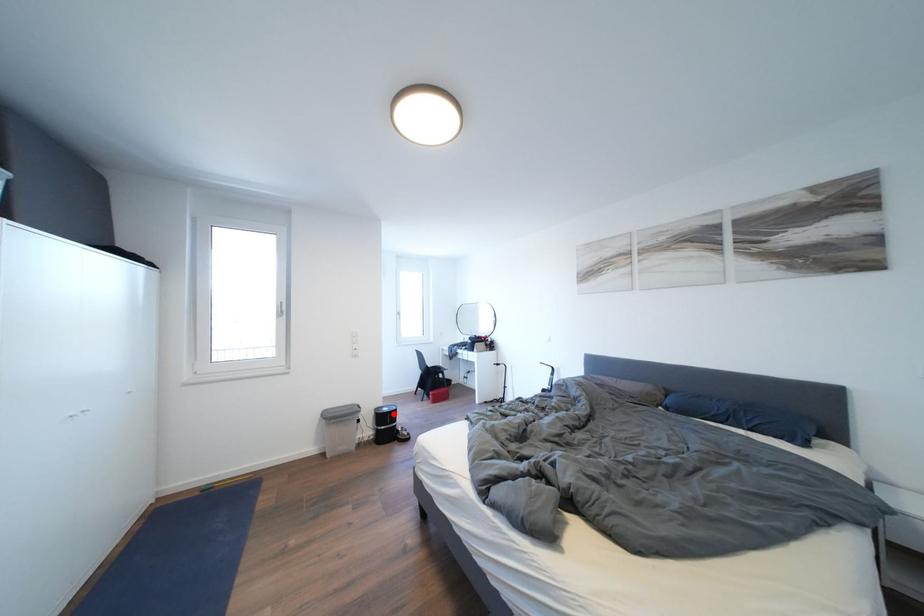
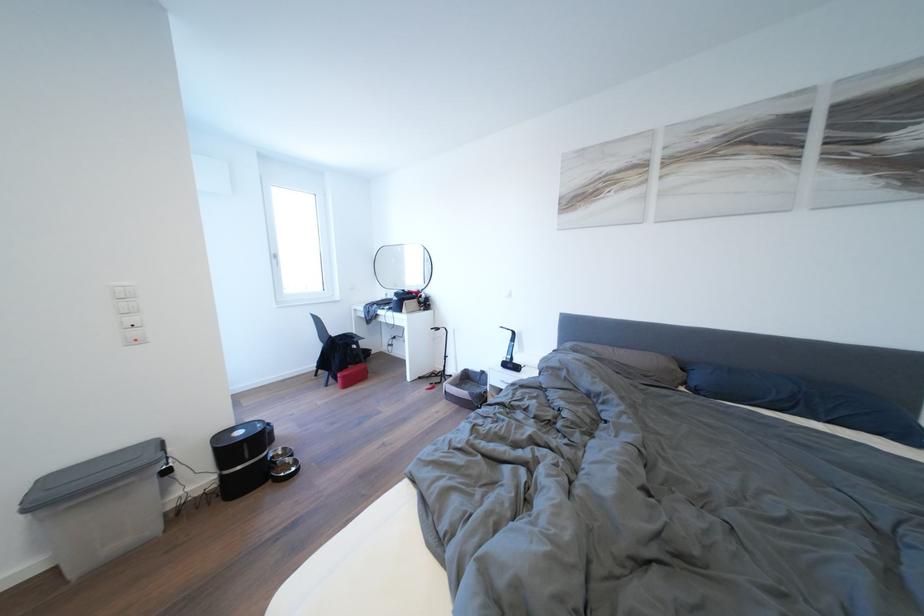
Question: I am providing you with two images of the same scene from different viewpoints. A red point is marked on the first image. Can you still see the location of the red point in image 2?

Choices:
 (A) Yes
 (B) No

Answer: (A)